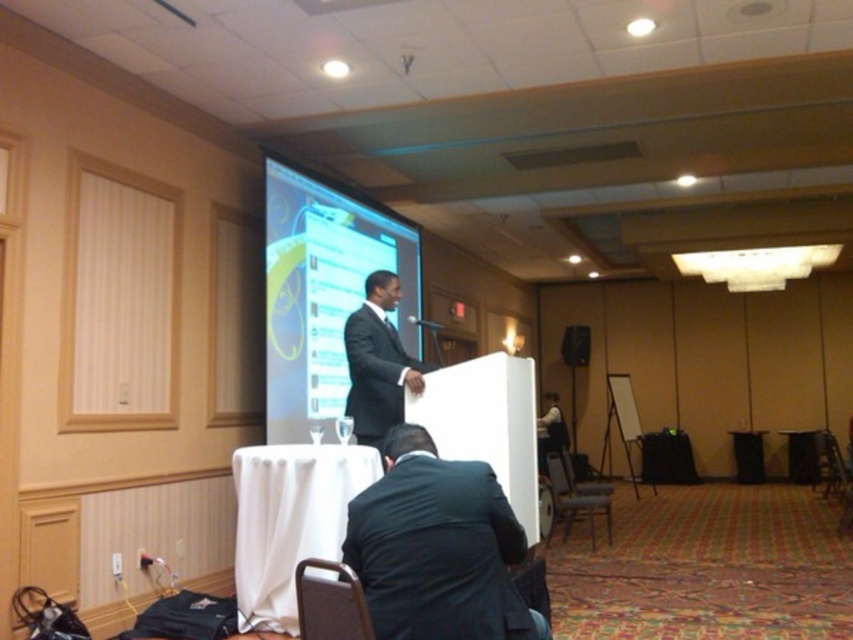
Question: Does matte black screen at center lie in front of white cloth-covered table at lower center?

Choices:
 (A) no
 (B) yes

Answer: (A)

Question: Which point is closer to the camera?

Choices:
 (A) black fabric speaker at center
 (B) black matte suit at center
 (C) matte black screen at center
 (D) white cloth-covered table at lower center

Answer: (D)

Question: Can you confirm if matte black screen at center is positioned above white cloth-covered table at lower center?

Choices:
 (A) no
 (B) yes

Answer: (B)

Question: Observing the image, what is the correct spatial positioning of black matte suit at center in reference to metallic silver chair at lower center?

Choices:
 (A) below
 (B) above

Answer: (B)

Question: Which point is closer to the camera?

Choices:
 (A) [x=318, y=221]
 (B) [x=572, y=356]
 (C) [x=386, y=449]
 (D) [x=363, y=342]

Answer: (C)

Question: Which point is closer to the camera?

Choices:
 (A) (593, 544)
 (B) (288, 323)
 (C) (412, 468)

Answer: (C)